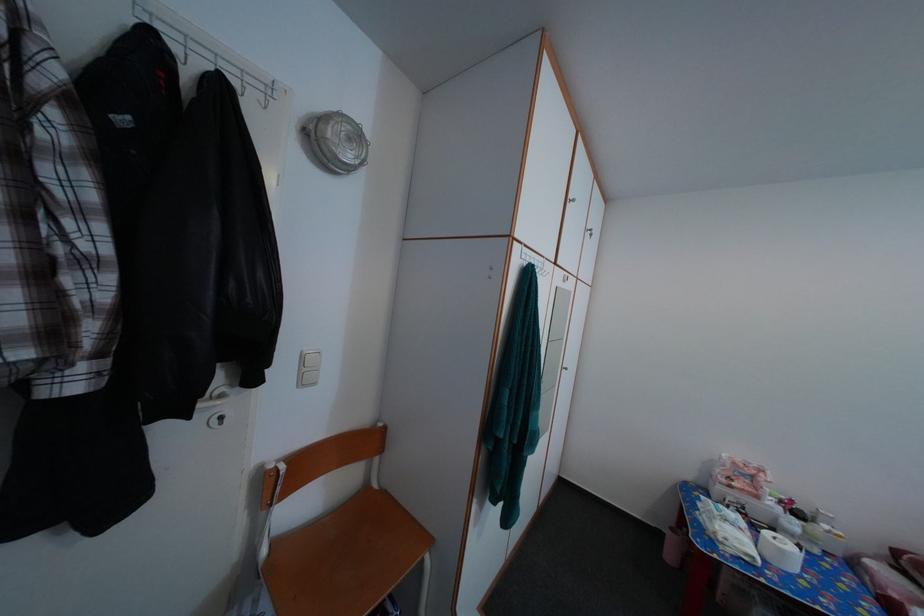
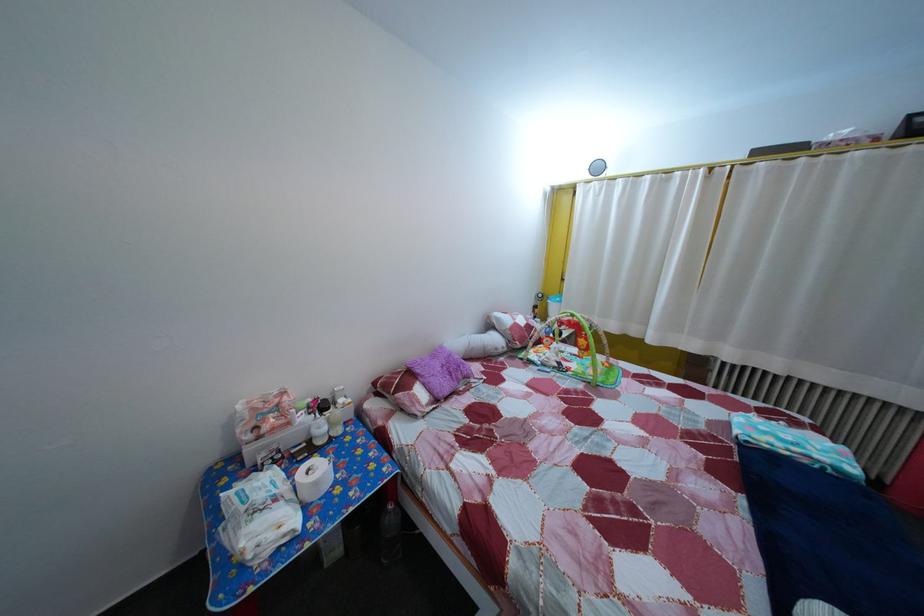
Where in the second image is the point corresponding to point 792,560 from the first image?

(325, 491)